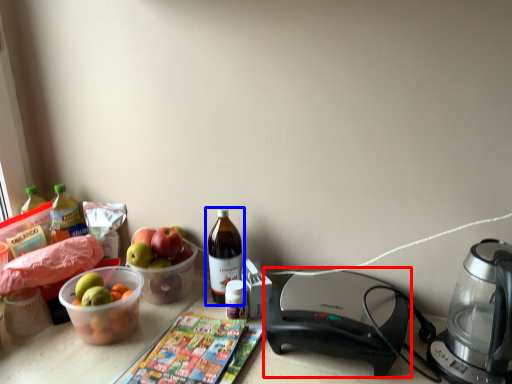
Question: Which of the following is the farthest to the observer, appliance (highlighted by a red box) or bottle (highlighted by a blue box)?

Choices:
 (A) appliance
 (B) bottle

Answer: (B)